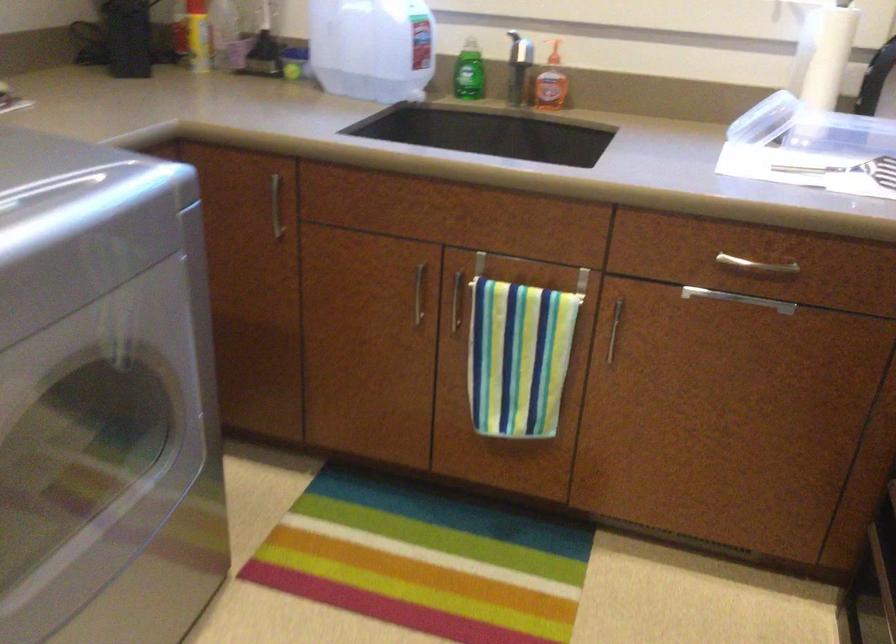
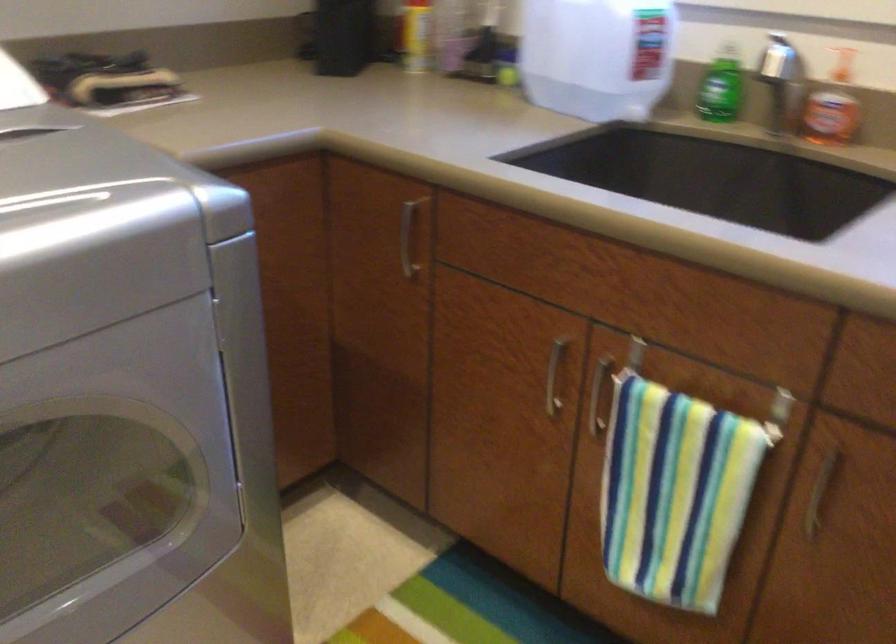
Find the pixel in the second image that matches point 613,332 in the first image.

(819, 494)